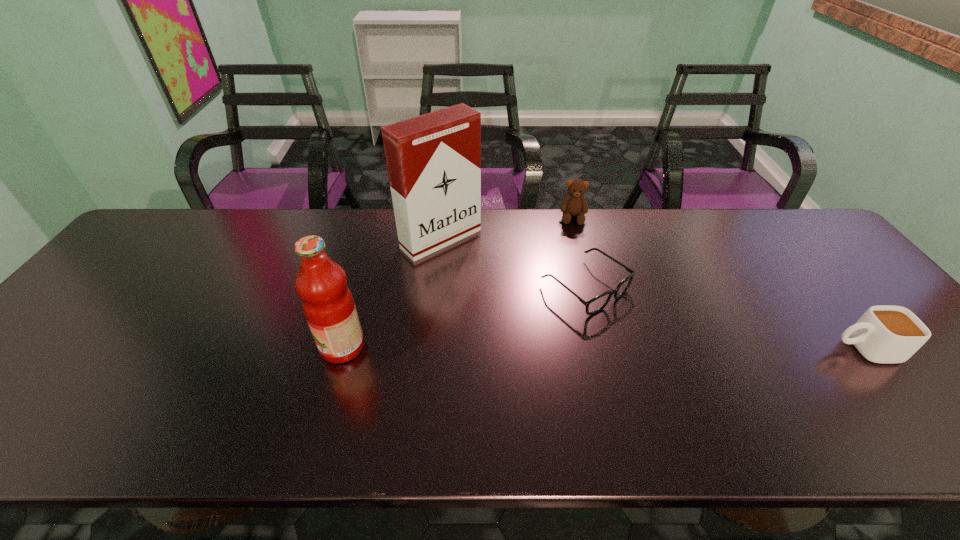
Locate an element on the screen. Image resolution: width=960 pixels, height=540 pixels. the leftmost object is located at coordinates (328, 305).

You are a GUI agent. You are given a task and a screenshot of the screen. Output one action in this format:
    pyautogui.click(x=<x>, y=<y>)
    Task: Click on the second tallest object
    
    Given the screenshot: What is the action you would take?
    pyautogui.click(x=328, y=305)

Find the location of `the rightmost object`. the rightmost object is located at coordinates (884, 334).

The image size is (960, 540). Identify the location of the second shortest object. (884, 334).

You are a GUI agent. You are given a task and a screenshot of the screen. Output one action in this format:
    pyautogui.click(x=<x>, y=<y>)
    Task: Click on the cigarette_case
    
    Given the screenshot: What is the action you would take?
    pyautogui.click(x=434, y=160)

This screenshot has width=960, height=540. In order to click on the fourth object from right to left in this screenshot , I will do `click(434, 160)`.

Where is `spectacles`? This screenshot has width=960, height=540. spectacles is located at coordinates point(593,306).

Identify the location of the third shortest object. The height and width of the screenshot is (540, 960). (575, 204).

Identify the location of blank space located on the front label of the leftmost object. (228, 347).

Locate an element on the screen. The image size is (960, 540). vacant point located 0.130m on the front label of the leftmost object is located at coordinates (266, 347).